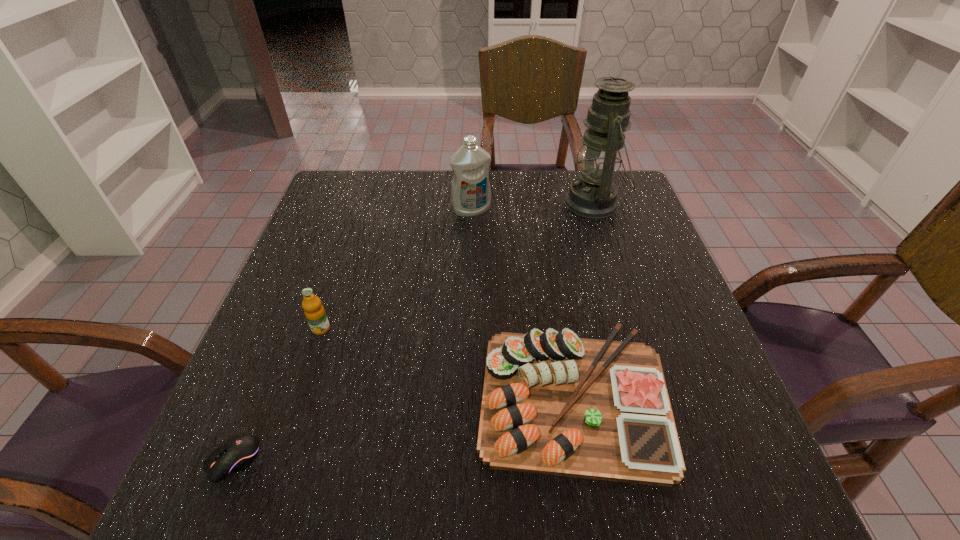
At what (x,y) coordinates should I click in order to perform the action: click on the tallest object. Please return your answer as a coordinate pair (x, y). Looking at the image, I should click on (593, 195).

Locate an element on the screen. This screenshot has width=960, height=540. detergent is located at coordinates pyautogui.click(x=470, y=191).

You are a GUI agent. You are given a task and a screenshot of the screen. Output one action in this format:
    pyautogui.click(x=<x>, y=<y>)
    Task: Click on the fourth object from right to left
    The image size is (960, 540).
    Given the screenshot: What is the action you would take?
    coord(315,314)

Find the location of a particular element. The image size is (960, 540). the third shortest object is located at coordinates (315, 314).

You are a GUI agent. You are given a task and a screenshot of the screen. Output one action in this format:
    pyautogui.click(x=<x>, y=<y>)
    Task: Click on the platter
    The image size is (960, 540).
    Given the screenshot: What is the action you would take?
    pyautogui.click(x=553, y=403)

Find the location of a particular element. The height and width of the screenshot is (540, 960). the shortest object is located at coordinates (234, 455).

Find the location of `computer mouse`. computer mouse is located at coordinates (234, 455).

This screenshot has width=960, height=540. Find the location of `free space located 0.260m on the left of the oil lamp`. free space located 0.260m on the left of the oil lamp is located at coordinates (472, 203).

Identify the location of free region located on the right of the second tallest object. (596, 210).

Where is `vacant space located on the label of the third tallest object`? This screenshot has width=960, height=540. vacant space located on the label of the third tallest object is located at coordinates (292, 417).